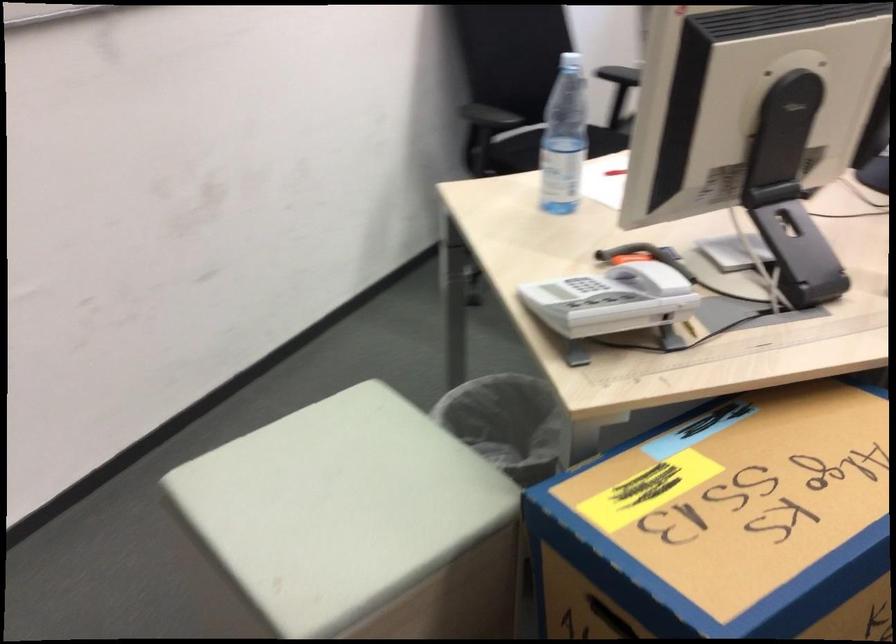
What do you see at coordinates (339, 502) in the screenshot?
I see `a padded stool surface` at bounding box center [339, 502].